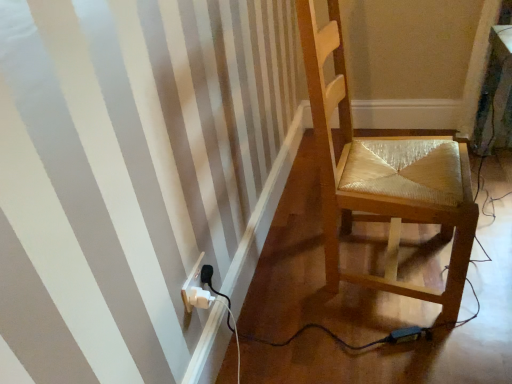
Question: From the image's perspective, is wooden chair at right below white plastic electrical outlet at lower left?

Choices:
 (A) no
 (B) yes

Answer: (A)

Question: Considering the relative sizes of wooden chair at right and white plastic electrical outlet at lower left in the image provided, is wooden chair at right wider than white plastic electrical outlet at lower left?

Choices:
 (A) no
 (B) yes

Answer: (B)

Question: Considering the relative sizes of wooden chair at right and white plastic electrical outlet at lower left in the image provided, is wooden chair at right smaller than white plastic electrical outlet at lower left?

Choices:
 (A) no
 (B) yes

Answer: (A)

Question: Are wooden chair at right and white plastic electrical outlet at lower left making contact?

Choices:
 (A) yes
 (B) no

Answer: (B)

Question: Can you confirm if wooden chair at right is taller than white plastic electrical outlet at lower left?

Choices:
 (A) yes
 (B) no

Answer: (A)

Question: Is white plastic electrical outlet at lower left located within wooden chair at right?

Choices:
 (A) no
 (B) yes

Answer: (A)

Question: Does white plastic electrical outlet at lower left have a lesser width compared to wooden chair at right?

Choices:
 (A) yes
 (B) no

Answer: (A)

Question: Does white plastic electrical outlet at lower left have a lesser height compared to wooden chair at right?

Choices:
 (A) yes
 (B) no

Answer: (A)

Question: Can you see white plastic electrical outlet at lower left touching wooden chair at right?

Choices:
 (A) no
 (B) yes

Answer: (A)

Question: Is white plastic electrical outlet at lower left at the left side of wooden chair at right?

Choices:
 (A) no
 (B) yes

Answer: (B)

Question: Is white plastic electrical outlet at lower left positioned with its back to wooden chair at right?

Choices:
 (A) yes
 (B) no

Answer: (B)

Question: Is wooden chair at right inside white plastic electrical outlet at lower left?

Choices:
 (A) no
 (B) yes

Answer: (A)

Question: Is wooden chair at right in front of or behind white plastic electrical outlet at lower left in the image?

Choices:
 (A) front
 (B) behind

Answer: (A)